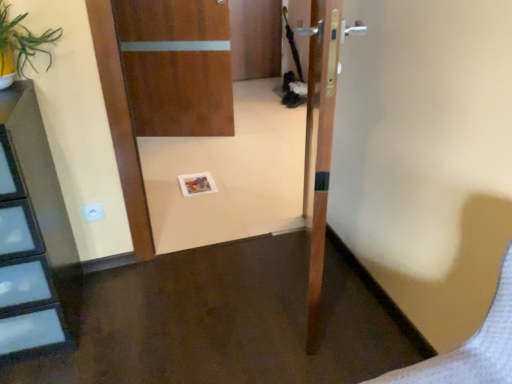
Question: In terms of height, does wooden door at center, which is counted as the second door, starting from the back, look taller or shorter compared to green leafy plant at upper left?

Choices:
 (A) tall
 (B) short

Answer: (A)

Question: Looking at their shapes, would you say wooden door at center, the second door when ordered from left to right, is wider or thinner than green leafy plant at upper left?

Choices:
 (A) thin
 (B) wide

Answer: (A)

Question: Estimate the real-world distances between objects in this image. Which object is closer to the wooden door at center, placed as the 1th door when sorted from back to front?

Choices:
 (A) green leafy plant at upper left
 (B) white plastic electric outlet at lower left
 (C) wooden door at center, marked as the first door in a front-to-back arrangement

Answer: (C)

Question: Estimate the real-world distances between objects in this image. Which object is closer to the white plastic electric outlet at lower left?

Choices:
 (A) wooden door at center, arranged as the 1th door when viewed from the left
 (B) green leafy plant at upper left
 (C) wooden door at center, marked as the first door in a front-to-back arrangement

Answer: (B)